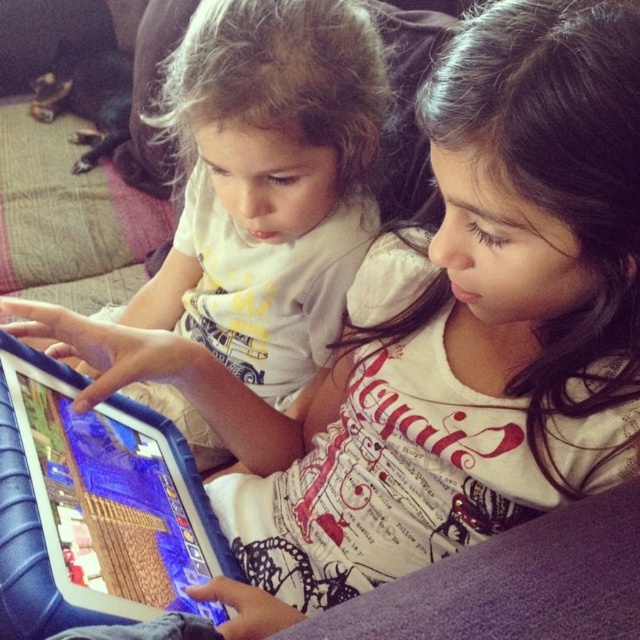
Question: Which point is farther to the camera?

Choices:
 (A) matte white shirt at center
 (B) blue rubberized tablet at center

Answer: (A)

Question: Does matte white shirt at center have a larger size compared to blue rubberized tablet at center?

Choices:
 (A) no
 (B) yes

Answer: (B)

Question: Does matte white shirt at center lie in front of blue rubberized tablet at center?

Choices:
 (A) yes
 (B) no

Answer: (B)

Question: Which object is closer to the camera taking this photo?

Choices:
 (A) blue rubberized tablet at center
 (B) matte white shirt at center

Answer: (A)

Question: Which point is farther to the camera?

Choices:
 (A) blue rubberized tablet at center
 (B) matte white shirt at center

Answer: (B)

Question: Can you confirm if matte white shirt at center is wider than blue rubberized tablet at center?

Choices:
 (A) yes
 (B) no

Answer: (A)